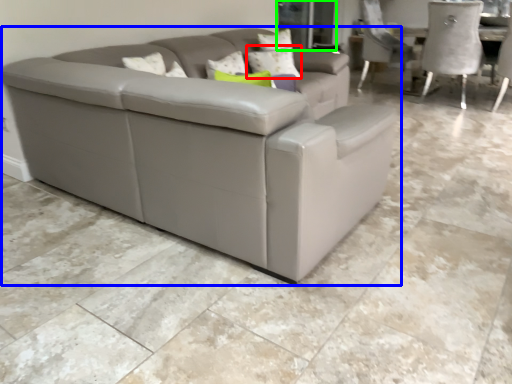
Question: Which object is the farthest from pillow (highlighted by a red box)? Choose among these: studio couch (highlighted by a blue box) or glass door (highlighted by a green box).

Choices:
 (A) studio couch
 (B) glass door

Answer: (B)